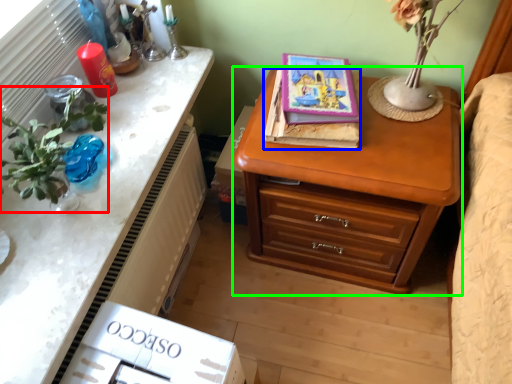
Question: Considering the real-world distances, which object is closest to floral arrangement (highlighted by a red box)? book (highlighted by a blue box) or chest of drawers (highlighted by a green box).

Choices:
 (A) book
 (B) chest of drawers

Answer: (A)